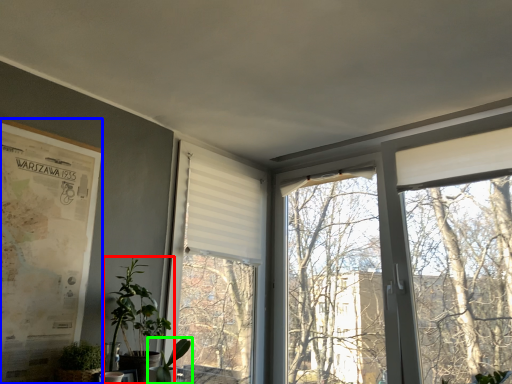
Question: Which object is the farthest from houseplant (highlighted by a red box)? Choose among these: poster page (highlighted by a blue box) or houseplant (highlighted by a green box).

Choices:
 (A) poster page
 (B) houseplant

Answer: (A)